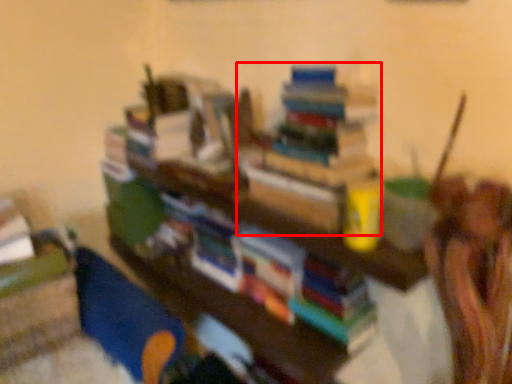
Question: Considering the relative positions of book (annotated by the red box) and shelf in the image provided, where is book (annotated by the red box) located with respect to the staircase?

Choices:
 (A) left
 (B) right

Answer: (B)